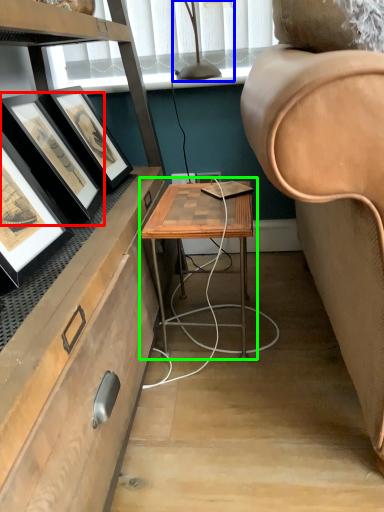
Question: Considering the real-world distances, which object is closest to picture frame (highlighted by a red box)? table lamp (highlighted by a blue box) or table (highlighted by a green box).

Choices:
 (A) table lamp
 (B) table

Answer: (B)